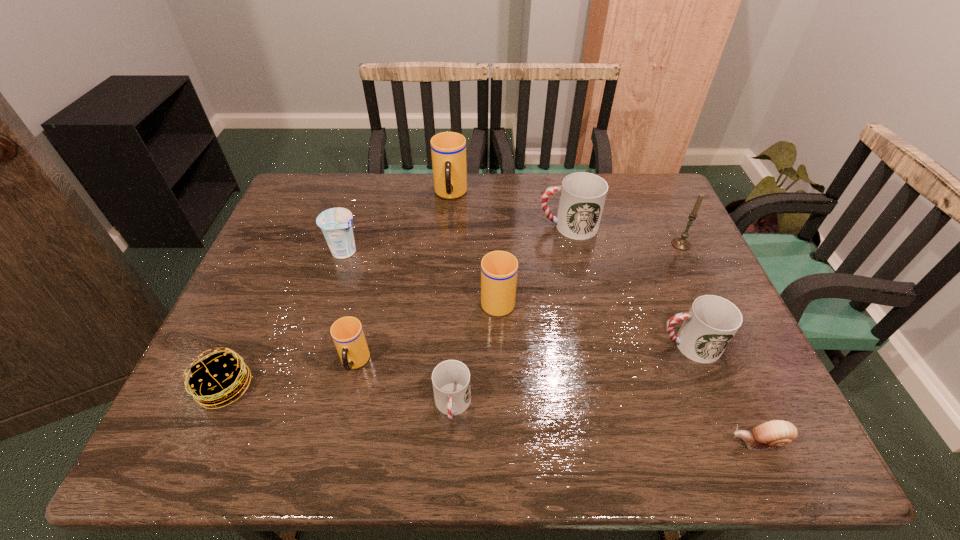
Where is `the sixth closest cup to the leftmost object`? The height and width of the screenshot is (540, 960). the sixth closest cup to the leftmost object is located at coordinates (712, 321).

I want to click on beige cup that is the nearest to the fifth cup from left to right, so click(499, 269).

Identify which beige cup is located as the second nearest to the leftmost cup. Please provide its 2D coordinates. Your answer should be formatted as a tuple, i.e. [(x, y)], where the tuple contains the x and y coordinates of a point satisfying the conditions above.

[(448, 149)]

The height and width of the screenshot is (540, 960). Find the location of `red cup identified as the closest to the shortest cup`. red cup identified as the closest to the shortest cup is located at coordinates (712, 321).

Image resolution: width=960 pixels, height=540 pixels. What are the coordinates of `red cup that stands as the second closest to the patty` in the screenshot? It's located at (582, 195).

The image size is (960, 540). I want to click on vacant space that satisfies the following two spatial constraints: 1. on the side of the second smallest beige cup with the handle; 2. on the side of the biggest red cup where the handle is located, so click(495, 226).

What are the coordinates of `free space that satisfies the following two spatial constraints: 1. on the side of the rightmost beige cup with the handle; 2. on the right side of the candle` in the screenshot? It's located at (495, 244).

At what (x,y) coordinates should I click in order to perform the action: click on free space that satisfies the following two spatial constraints: 1. on the side of the fifth nearest cup where the handle is located; 2. on the side of the second beige cup from left to right with the handle. Please return your answer as a coordinate pair (x, y). This screenshot has width=960, height=540. Looking at the image, I should click on (561, 194).